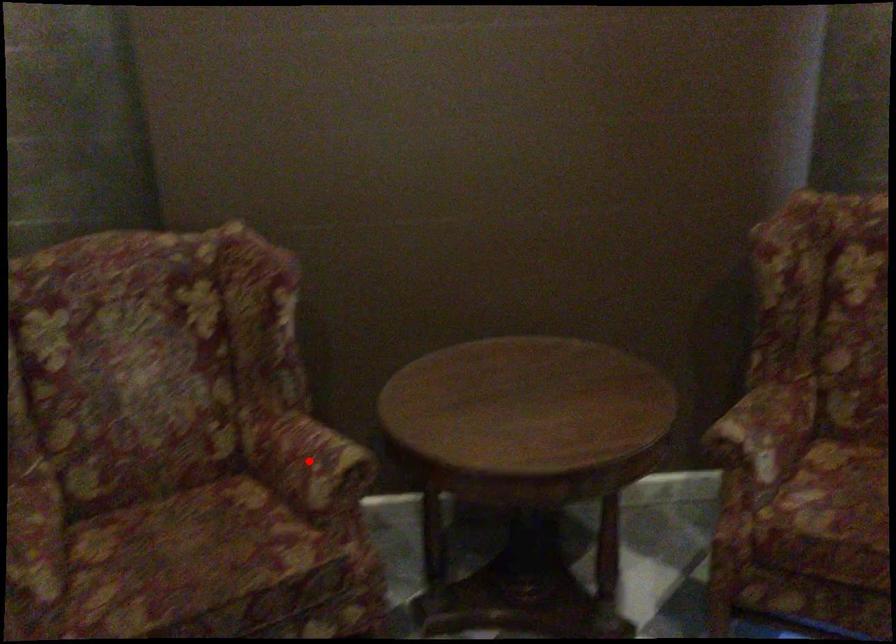
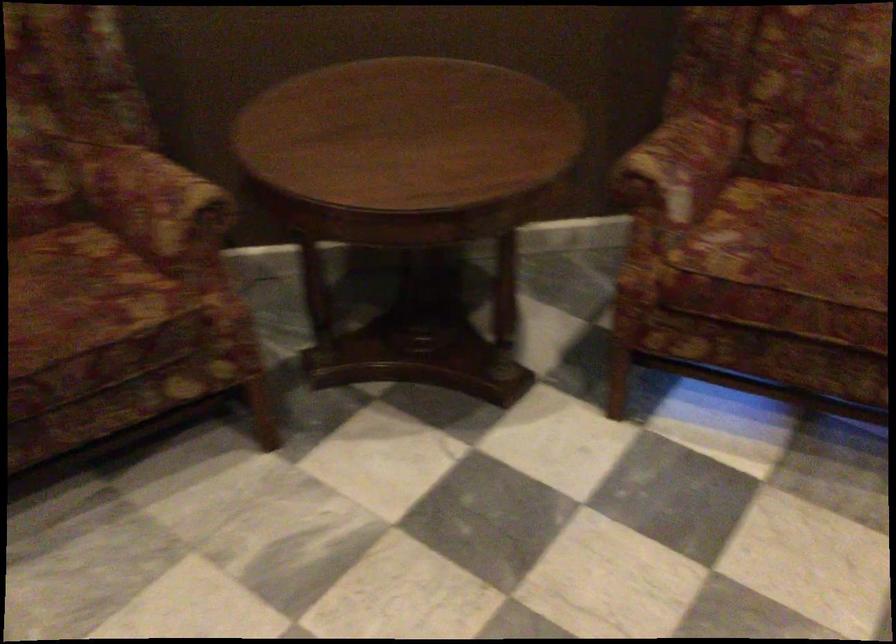
Question: I am providing you with two images of the same scene from different viewpoints. In image1, a red point is highlighted. Considering the same 3D point in image2, which of the following is correct?

Choices:
 (A) It is closer
 (B) It is farther

Answer: (A)